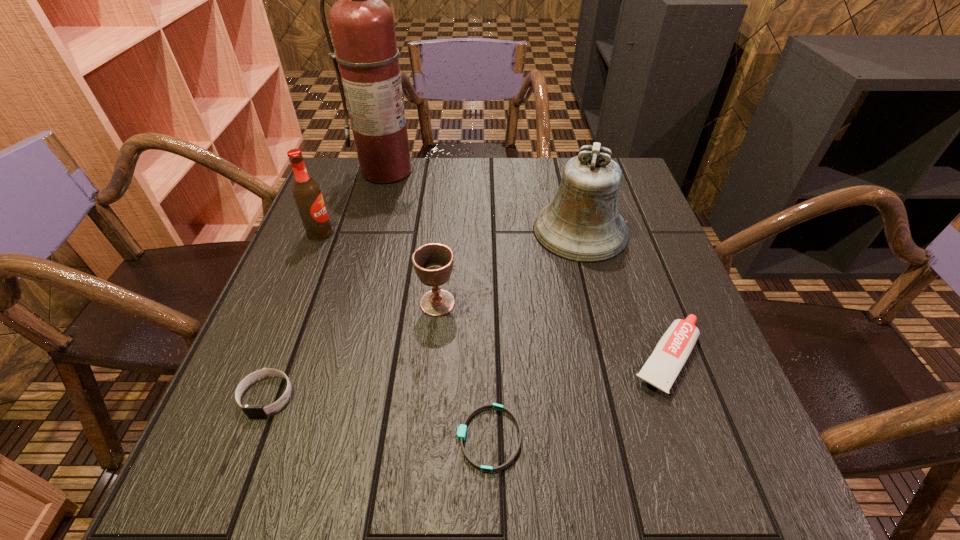
Locate an element on the screen. vacant area at the far edge of the desktop is located at coordinates (401, 198).

In the image, there is a desktop. Find the location of `vacant space at the near edge`. vacant space at the near edge is located at coordinates (323, 454).

Identify the location of vacant space at the left edge. This screenshot has height=540, width=960. (271, 382).

Find the location of `vacant space at the right edge`. vacant space at the right edge is located at coordinates (652, 402).

This screenshot has width=960, height=540. In order to click on free region at the near right corner of the desktop in this screenshot , I will do `click(760, 498)`.

I want to click on free space between the left wristband and the bell, so pos(423,313).

Where is `free area in between the left wristband and the fourth farthest object`? free area in between the left wristband and the fourth farthest object is located at coordinates (352, 349).

Image resolution: width=960 pixels, height=540 pixels. Find the location of `vacant space that is in between the fifth object from left to right and the third shortest object`. vacant space that is in between the fifth object from left to right and the third shortest object is located at coordinates (578, 398).

Identify the location of vacant space that is in between the shorter wristband and the taller wristband. The image size is (960, 540). (378, 417).

Where is `vacant point located between the sixth tallest object and the beer bottle`? Image resolution: width=960 pixels, height=540 pixels. vacant point located between the sixth tallest object and the beer bottle is located at coordinates (294, 314).